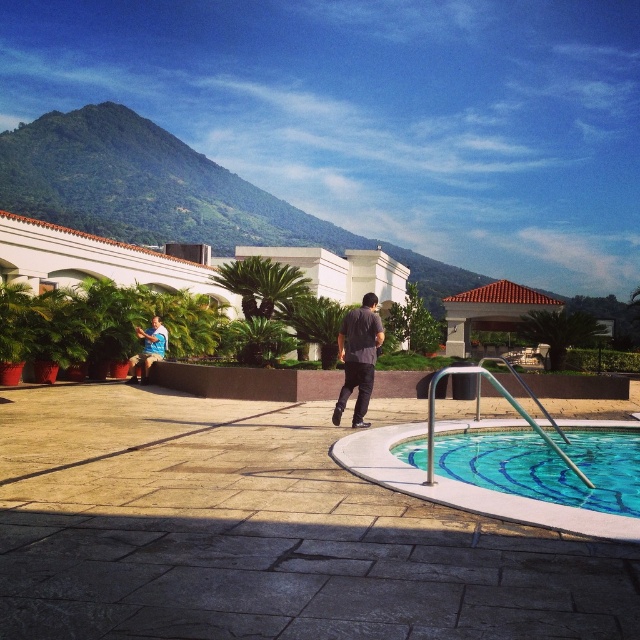
Question: Which point is farther to the camera?

Choices:
 (A) clear glass pool at lower right
 (B) matte blue shirt at lower left

Answer: (B)

Question: Which point is farther to the camera?

Choices:
 (A) brown tile roof gazebo at upper center
 (B) green leafy mountain at upper left
 (C) matte blue shirt at lower left
 (D) dark gray shirt at center

Answer: (B)

Question: From the image, what is the correct spatial relationship of green leafy mountain at upper left in relation to dark gray shirt at center?

Choices:
 (A) below
 (B) above

Answer: (B)

Question: Which point is farther to the camera?

Choices:
 (A) (360, 340)
 (B) (513, 436)
 (C) (173, 230)

Answer: (C)

Question: Is the position of green leafy mountain at upper left more distant than that of dark gray shirt at center?

Choices:
 (A) yes
 (B) no

Answer: (A)

Question: Is green leafy mountain at upper left wider than dark gray shirt at center?

Choices:
 (A) no
 (B) yes

Answer: (B)